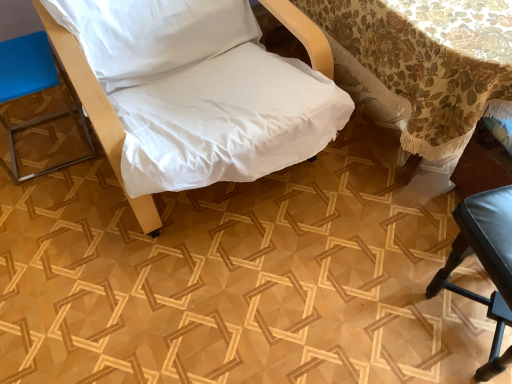
The width and height of the screenshot is (512, 384). What are the coordinates of `empty space that is ontop of blue leather stool at left, marked as the third furniture in a right-to-left arrangement` in the screenshot? It's located at (16, 62).